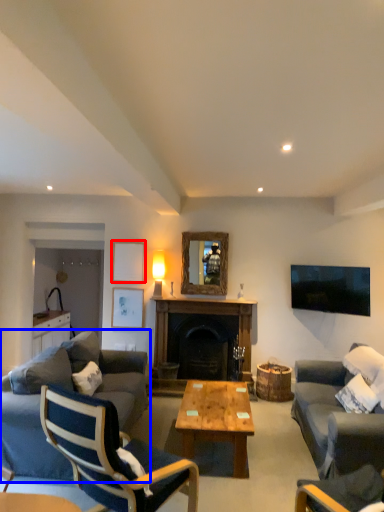
Question: Which point is further to the camera, picture frame (highlighted by a red box) or studio couch (highlighted by a blue box)?

Choices:
 (A) picture frame
 (B) studio couch

Answer: (A)